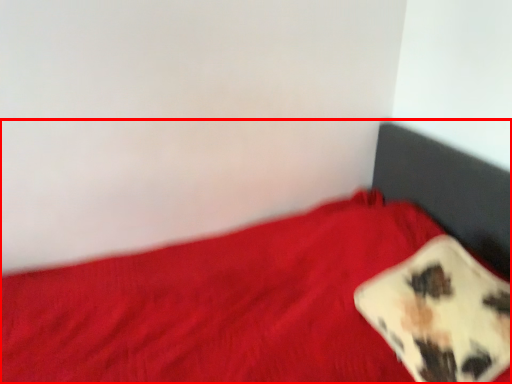
Question: In this image, where is bed (annotated by the red box) located relative to pillow?

Choices:
 (A) left
 (B) right

Answer: (A)